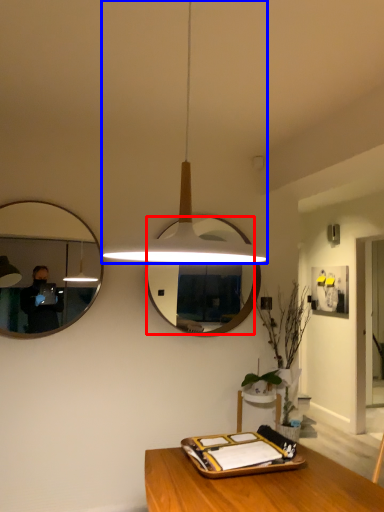
Question: Which object appears closest to the camera in this image, mirror (highlighted by a red box) or lamp (highlighted by a blue box)?

Choices:
 (A) mirror
 (B) lamp

Answer: (B)